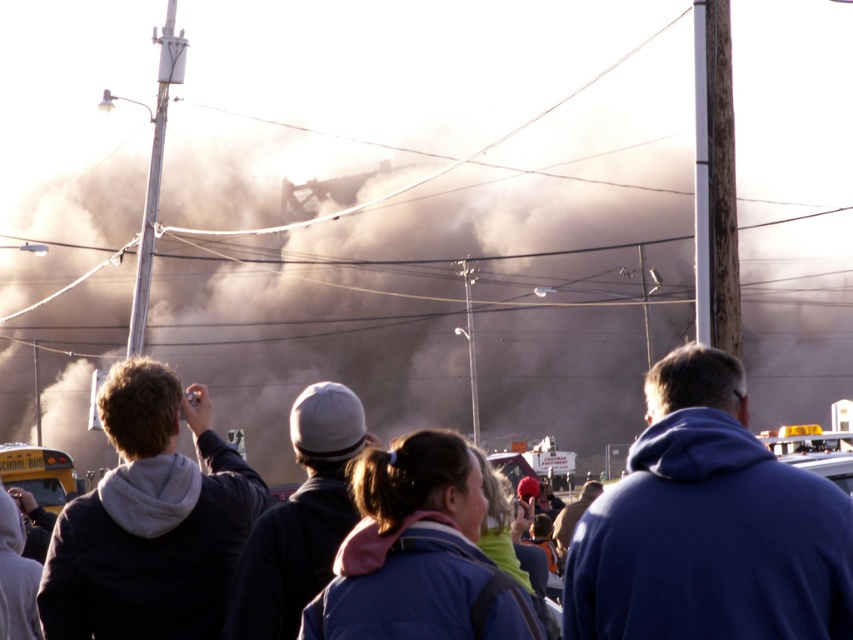
Does point (334, 534) lie in front of point (71, 460)?

Yes, it is.

Who is more forward, (260, 545) or (12, 486)?

Point (260, 545) is more forward.

The image size is (853, 640). In order to click on gray knit cap at center in this screenshot , I will do `click(299, 520)`.

I want to click on gray knit cap at center, so click(x=299, y=520).

Between point (840, 563) and point (421, 509), which one is positioned behind?

The point (421, 509) is more distant.

The height and width of the screenshot is (640, 853). Describe the element at coordinates (709, 525) in the screenshot. I see `blue fleece jacket at center` at that location.

Identify the location of blue fleece jacket at center. (709, 525).

In the scene shown: Can you confirm if blue fleece jacket at center is positioned to the left of yellow painted school bus at lower left?

Incorrect, blue fleece jacket at center is not on the left side of yellow painted school bus at lower left.

Who is lower down, blue fleece jacket at center or yellow painted school bus at lower left?

yellow painted school bus at lower left is below.

Where is `blue fleece jacket at center`? The height and width of the screenshot is (640, 853). blue fleece jacket at center is located at coordinates (709, 525).